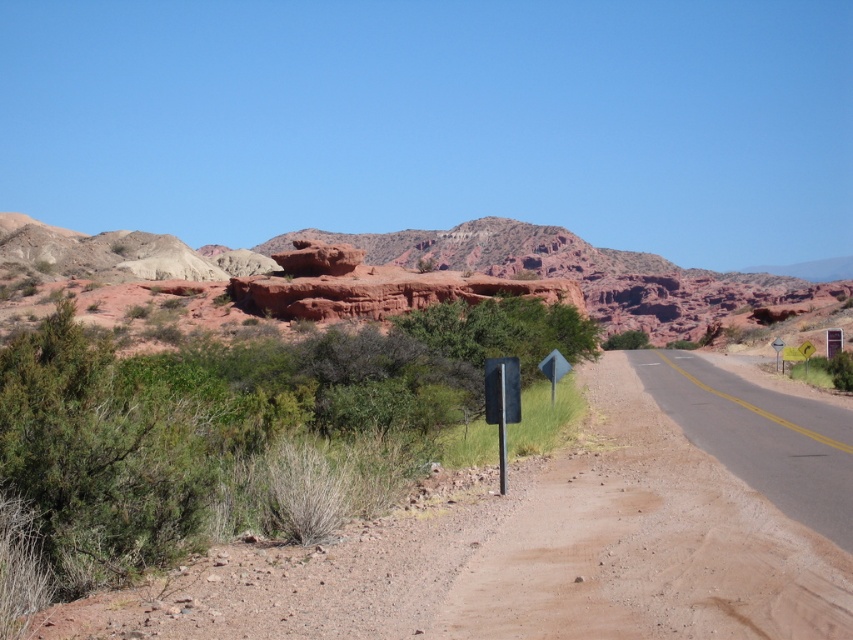
You are a hiker planning to walk from the reddish rock formation at center to the metallic triangular sign at right. Given that your average walking speed is 5 km per hour, approximately how many minutes will it take you to reach the sign?

The distance between the reddish rock formation at center and the metallic triangular sign at right is 107.74 meters. Converting this to kilometers gives 0.10774 km. Dividing by the walking speed of 5 km per hour results in 0.0215 hours. Multiplying by 60 minutes gives approximately 1.29 minutes, so roughly 1.3 minutes.

You are driving a car that is 2 meters long. You see the brown gravel dirt track at center and the black metal sign at center. Which object is closer to you as you drive along the road?

The brown gravel dirt track at center is in front of the black metal sign at center, so the brown gravel dirt track at center is closer to you as you drive along the road.